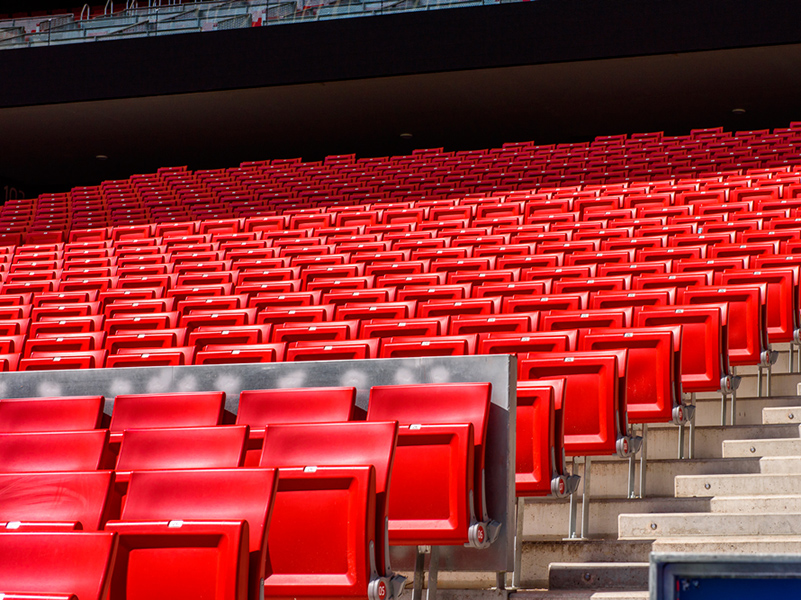
You are a GUI agent. You are given a task and a screenshot of the screen. Output one action in this format:
    pyautogui.click(x=<x>, y=<y>)
    Task: Click on the stairs
    
    Given the screenshot: What is the action you would take?
    pyautogui.click(x=586, y=582), pyautogui.click(x=646, y=547), pyautogui.click(x=673, y=525), pyautogui.click(x=753, y=503), pyautogui.click(x=757, y=486), pyautogui.click(x=779, y=462), pyautogui.click(x=779, y=449), pyautogui.click(x=789, y=413)